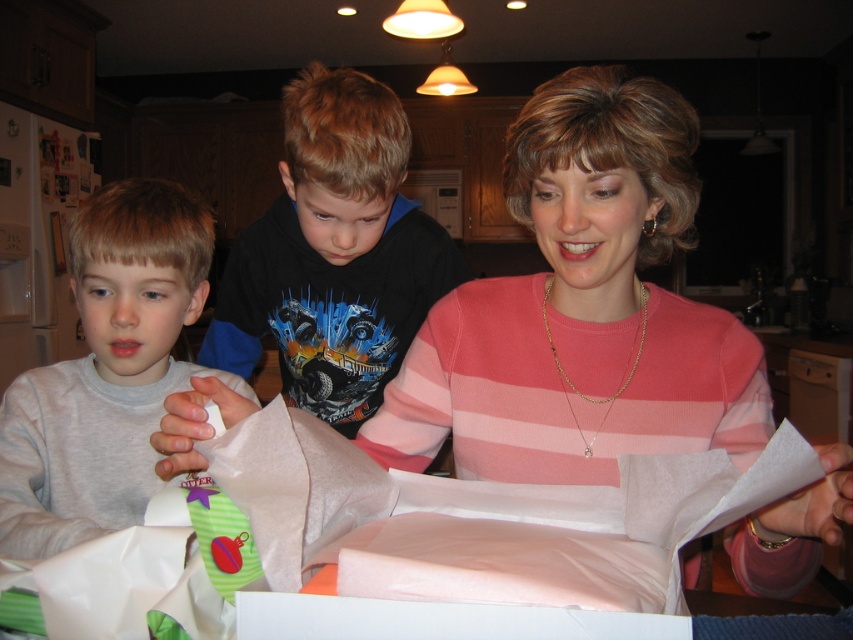
Consider the image. You are a photographer trying to capture a candid shot of both the pink striped sweater at center and the black cotton shirt at center. Since you want to ensure both are visible in the frame, can you determine if the photographer can capture both subjects without one blocking the other?

The pink striped sweater at center is in front of the black cotton shirt at center, so the photographer will not be able to see the black cotton shirt at center clearly in the photo because it is partially or fully obscured by the pink striped sweater at center.

You are a fashion designer observing the scene. You need to decide which clothing item, the pink striped sweater at center or the black cotton shirt at center, would require more fabric to make. Based on the scene description, which one would need more material?

The pink striped sweater at center requires more fabric because its width is larger than the black cotton shirt at center, indicating it might be a larger garment overall.

You are organizing a charity event and need to decide which shirt to donate. The black cotton shirt at center and gray cotton shirt at left are both available. Based on their sizes, which one should you choose if you want to donate the larger one?

→ The black cotton shirt at center is bigger than gray cotton shirt at left, so you should choose the black cotton shirt at center for donation as it is the larger one.